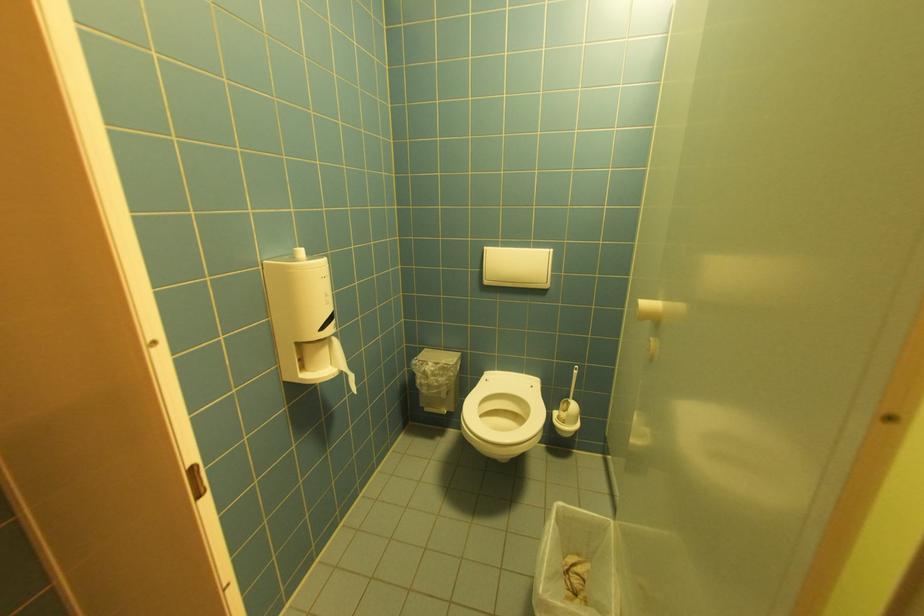
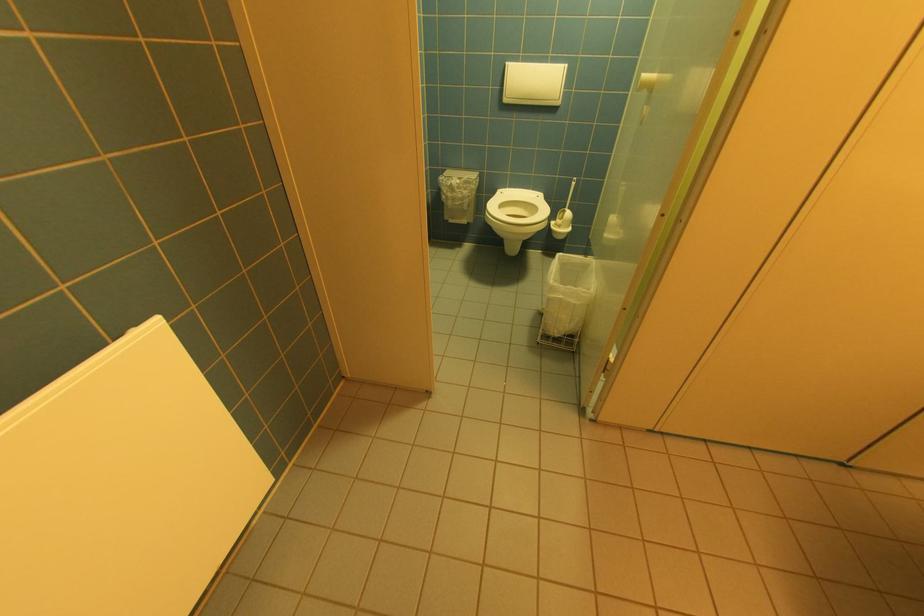
Where in the second image is the point corresponding to pixel 569 507 from the first image?

(568, 256)